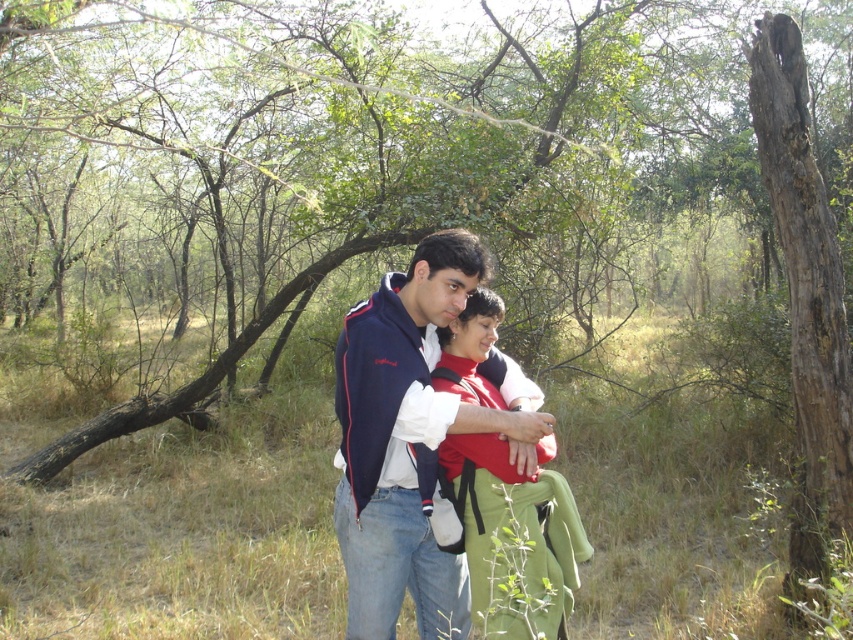
Question: Which of the following is the farthest from the observer?

Choices:
 (A) (498, 637)
 (B) (415, 260)

Answer: (B)

Question: Which of the following is the farthest from the observer?

Choices:
 (A) (517, 531)
 (B) (344, 461)

Answer: (B)

Question: Is matte blue jacket at center smaller than red soft fabric baby at center?

Choices:
 (A) no
 (B) yes

Answer: (A)

Question: Does matte blue jacket at center have a greater width compared to red soft fabric baby at center?

Choices:
 (A) no
 (B) yes

Answer: (B)

Question: Does matte blue jacket at center lie in front of red soft fabric baby at center?

Choices:
 (A) yes
 (B) no

Answer: (B)